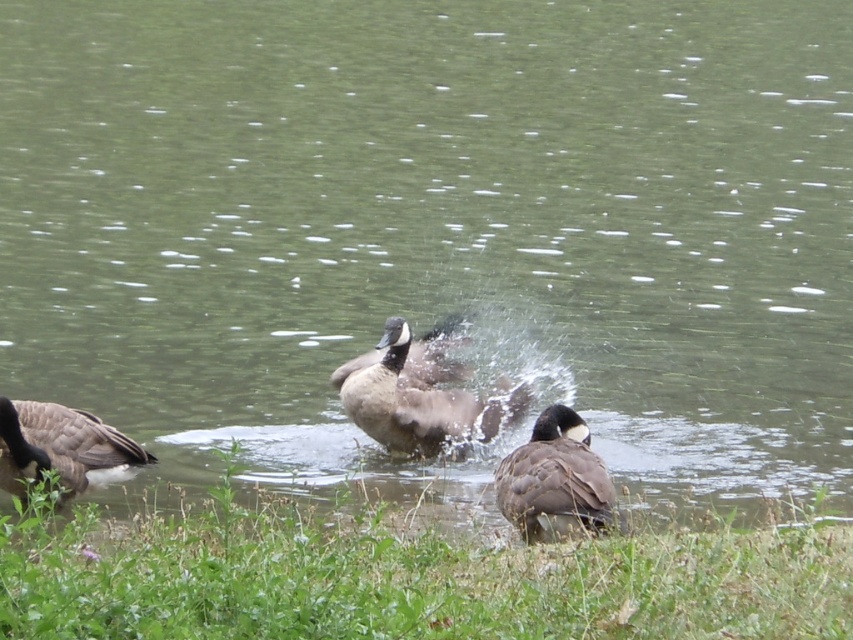
Who is positioned more to the right, green leafy grass at lower center or brown feathered duck at center?

green leafy grass at lower center

I want to click on green leafy grass at lower center, so click(405, 577).

What are the coordinates of `green leafy grass at lower center` in the screenshot? It's located at (405, 577).

Does green leafy grass at lower center have a larger size compared to brown feathered duck at lower right?

Correct, green leafy grass at lower center is larger in size than brown feathered duck at lower right.

Does point (26, 513) come closer to viewer compared to point (590, 460)?

Yes.

I want to click on green leafy grass at lower center, so click(x=405, y=577).

Between brown matte duck at center and brown feathered duck at lower right, which one has less height?

Standing shorter between the two is brown feathered duck at lower right.

At what (x,y) coordinates should I click in order to perform the action: click on brown matte duck at center. Please return your answer as a coordinate pair (x, y). The image size is (853, 640). Looking at the image, I should click on (418, 394).